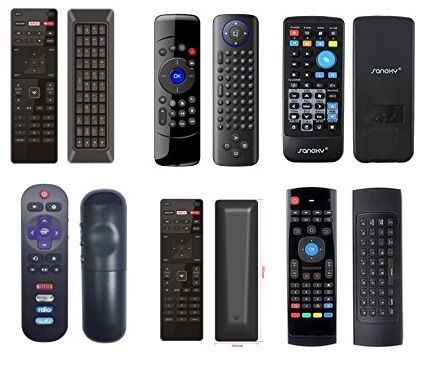
What are the coordinates of `front of remote controls` in the screenshot? It's located at (306, 261), (306, 113), (175, 85), (17, 96), (44, 260), (171, 268).